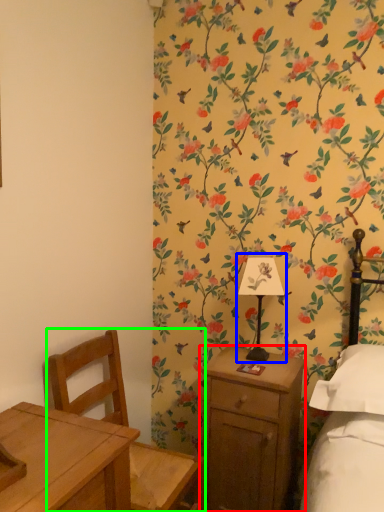
Question: Which is farther away from nightstand (highlighted by a red box)? bedside lamp (highlighted by a blue box) or chair (highlighted by a green box)?

Choices:
 (A) bedside lamp
 (B) chair

Answer: (B)